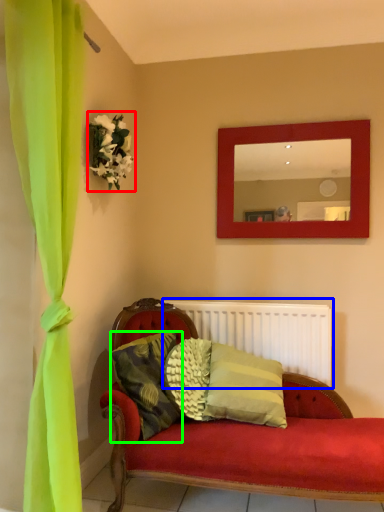
Question: Which object is positioned closest to floral arrangement (highlighted by a red box)? Select from radiator (highlighted by a blue box) and pillow (highlighted by a green box).

Choices:
 (A) radiator
 (B) pillow

Answer: (B)